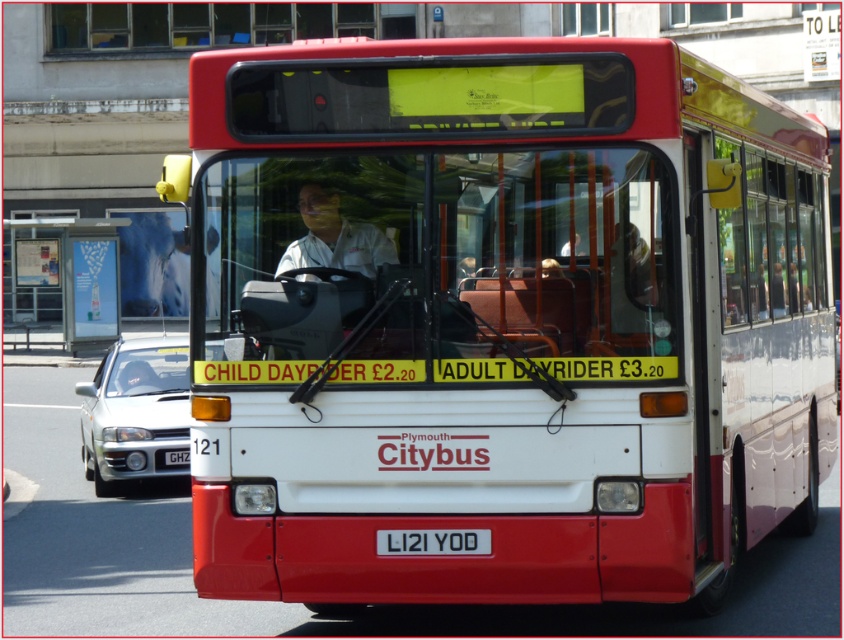
Question: Which object appears closest to the camera in this image?

Choices:
 (A) matte white bus at center
 (B) light beige fabric shirt at center
 (C) white glossy sedan at lower left
 (D) white plastic bus stop at upper left

Answer: (B)

Question: Does white glossy sedan at lower left have a smaller size compared to light beige fabric shirt at center?

Choices:
 (A) yes
 (B) no

Answer: (B)

Question: Can you confirm if white plastic bus stop at upper left is positioned to the right of white glossy sedan at lower left?

Choices:
 (A) yes
 (B) no

Answer: (B)

Question: Is matte white bus at center positioned in front of white glossy sedan at lower left?

Choices:
 (A) yes
 (B) no

Answer: (A)

Question: Which point is closer to the camera?

Choices:
 (A) (474, 545)
 (B) (211, 61)

Answer: (A)

Question: Among these objects, which one is nearest to the camera?

Choices:
 (A) matte white bus at center
 (B) white plastic bus stop at upper left

Answer: (A)